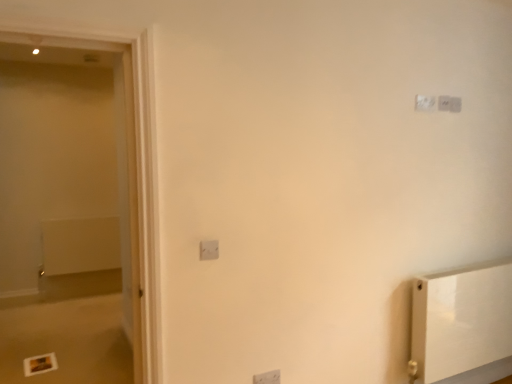
At what (x,y) coordinates should I click in order to perform the action: click on white plastic light switch at center, arranged as the 2th light switch when viewed from the left. Please return your answer as a coordinate pair (x, y). This screenshot has height=384, width=512. Looking at the image, I should click on 267,378.

Locate an element on the screen. The width and height of the screenshot is (512, 384). white matte radiator at left is located at coordinates (80, 245).

What are the coordinates of `white plastic light switch at upper right, the second light switch positioned from the right` in the screenshot? It's located at (425, 103).

How much space does white plastic light switch at upper right, arranged as the 4th light switch when ordered from the bottom, occupy vertically?

3.67 inches.

You are a GUI agent. You are given a task and a screenshot of the screen. Output one action in this format:
    pyautogui.click(x=<x>, y=<y>)
    Task: Click on the white plastic light switch at center, positioned as the second light switch in front-to-back order
    
    Given the screenshot: What is the action you would take?
    pyautogui.click(x=267, y=378)

Which is in front, white matte radiator at left or white plastic light switch at center, the 4th light switch in the top-to-bottom sequence?

Positioned in front is white plastic light switch at center, the 4th light switch in the top-to-bottom sequence.

Is white matte radiator at left inside the boundaries of white plastic light switch at center, the 4th light switch in the top-to-bottom sequence, or outside?

The correct answer is: outside.

Which of these two, white matte radiator at left or white plastic light switch at center, the 4th light switch in the top-to-bottom sequence, is thinner?

With smaller width is white plastic light switch at center, the 4th light switch in the top-to-bottom sequence.

This screenshot has height=384, width=512. What are the coordinates of `radiator on the left of white plastic light switch at center, acting as the 3th light switch starting from the back` in the screenshot? It's located at (80, 245).

Is white glossy screen door at left thinner than white plastic light switch at upper right, arranged as the 4th light switch when ordered from the bottom?

No, white glossy screen door at left is not thinner than white plastic light switch at upper right, arranged as the 4th light switch when ordered from the bottom.

Can we say white glossy screen door at left lies outside white plastic light switch at upper right, the fourth light switch in the left-to-right sequence?

Absolutely, white glossy screen door at left is external to white plastic light switch at upper right, the fourth light switch in the left-to-right sequence.

How distant is white glossy screen door at left from white plastic light switch at upper right, the fourth light switch in the left-to-right sequence?

They are 1.87 meters apart.

Between white glossy screen door at left and white plastic light switch at upper right, the 1th light switch viewed from the right, which one appears on the right side from the viewer's perspective?

Positioned to the right is white plastic light switch at upper right, the 1th light switch viewed from the right.

Can you tell me how much white plastic light switch at center, which is the third light switch in right-to-left order, and white plastic light switch at upper right, arranged as the 4th light switch when ordered from the bottom, differ in facing direction?

0.0305 degrees.

Which light switch is the 2nd one when counting from the front of the white plastic light switch at upper right, the 1th light switch viewed from the right? Please provide its 2D coordinates.

[(267, 378)]

From the picture: Which is less distant, (x=271, y=381) or (x=451, y=103)?

The point (x=271, y=381) is in front.

Based on the photo, choose the correct answer: Is white matte radiator at left inside white plastic light switch at upper right, positioned as the third light switch in bottom-to-top order, or outside it?

white matte radiator at left lies outside white plastic light switch at upper right, positioned as the third light switch in bottom-to-top order.

Considering the relative sizes of white matte radiator at left and white plastic light switch at upper right, which appears as the 2th light switch when viewed from the back, in the image provided, is white matte radiator at left smaller than white plastic light switch at upper right, which appears as the 2th light switch when viewed from the back,?

No, white matte radiator at left is not smaller than white plastic light switch at upper right, which appears as the 2th light switch when viewed from the back.

Considering the relative positions of white matte radiator at left and white plastic light switch at upper right, which appears as the 2th light switch when viewed from the back, in the image provided, is white matte radiator at left to the left of white plastic light switch at upper right, which appears as the 2th light switch when viewed from the back, from the viewer's perspective?

Indeed, white matte radiator at left is positioned on the left side of white plastic light switch at upper right, which appears as the 2th light switch when viewed from the back.

Considering their positions, is white matte radiator at left located in front of or behind white plastic light switch at upper right, which appears as the 2th light switch when viewed from the back?

Clearly, white matte radiator at left is behind white plastic light switch at upper right, which appears as the 2th light switch when viewed from the back.

Is white plastic light switch at upper right, the third light switch viewed from the front, inside white plastic light switch at center, the 4th light switch positioned from the right?

No, white plastic light switch at upper right, the third light switch viewed from the front, is located outside of white plastic light switch at center, the 4th light switch positioned from the right.

From the image's perspective, which is above, white plastic light switch at center, the 2th light switch in the bottom-to-top sequence, or white plastic light switch at upper right, the second light switch positioned from the top?

white plastic light switch at upper right, the second light switch positioned from the top, appears higher in the image.

Are white plastic light switch at center, the 4th light switch positioned from the right, and white plastic light switch at upper right, positioned as the third light switch in bottom-to-top order, beside each other?

white plastic light switch at center, the 4th light switch positioned from the right, and white plastic light switch at upper right, positioned as the third light switch in bottom-to-top order, are clearly separated.

Is white plastic light switch at center, which appears as the third light switch when viewed from the top, at the right side of white plastic light switch at upper right, which appears as the 2th light switch when viewed from the back?

Incorrect, white plastic light switch at center, which appears as the third light switch when viewed from the top, is not on the right side of white plastic light switch at upper right, which appears as the 2th light switch when viewed from the back.

Is point (456, 106) positioned in front of point (216, 256)?

No, (456, 106) is behind (216, 256).

Are white plastic light switch at upper right, marked as the 4th light switch in a front-to-back arrangement, and white plastic light switch at center, the 4th light switch viewed from the back, far apart?

Yes, white plastic light switch at upper right, marked as the 4th light switch in a front-to-back arrangement, and white plastic light switch at center, the 4th light switch viewed from the back, are quite far apart.

From a real-world perspective, who is located lower, white plastic light switch at upper right, the fourth light switch in the left-to-right sequence, or white plastic light switch at center, which is counted as the first light switch, starting from the front?

white plastic light switch at center, which is counted as the first light switch, starting from the front.

Locate an element on the screen. The image size is (512, 384). the 2nd light switch directly beneath the white plastic light switch at upper right, the fourth light switch in the left-to-right sequence (from a real-world perspective) is located at coordinates (209, 250).

In the scene shown: Is white matte radiator at left facing away from white glossy screen door at left?

white matte radiator at left is not turned away from white glossy screen door at left.

From the image's perspective, which object appears higher, white matte radiator at left or white glossy screen door at left?

white glossy screen door at left appears higher in the image.

From a real-world perspective, is white matte radiator at left positioned above or below white glossy screen door at left?

Clearly, from a real-world perspective, white matte radiator at left is below white glossy screen door at left.

Is white matte radiator at left wider or thinner than white glossy screen door at left?

white matte radiator at left is thinner than white glossy screen door at left.

Locate an element on the screen. This screenshot has width=512, height=384. light switch that is under the white matte radiator at left (from a real-world perspective) is located at coordinates (x=267, y=378).

There is a white glossy screen door at left. Identify the location of the 2nd light switch above it (from a real-world perspective). (449, 104).

Which object lies further to the anchor point white plastic light switch at upper right, which is the 1th light switch in back-to-front order, white matte radiator at left or white glossy screen door at left?

white matte radiator at left is positioned further to the anchor white plastic light switch at upper right, which is the 1th light switch in back-to-front order.

Estimate the real-world distances between objects in this image. Which object is closer to white plastic light switch at center, which is counted as the first light switch, starting from the front, white plastic light switch at upper right, the second light switch positioned from the top, or white matte radiator at left?

The object closer to white plastic light switch at center, which is counted as the first light switch, starting from the front, is white plastic light switch at upper right, the second light switch positioned from the top.

Based on their spatial positions, is white plastic light switch at center, which appears as the third light switch when viewed from the top, or white glossy screen door at left further from white plastic light switch at center, which is the third light switch in right-to-left order?

The object further to white plastic light switch at center, which is the third light switch in right-to-left order, is white glossy screen door at left.

Estimate the real-world distances between objects in this image. Which object is further from white plastic light switch at center, arranged as the 2th light switch when viewed from the left, white plastic light switch at center, the 4th light switch viewed from the back, or white plastic light switch at upper right, the second light switch positioned from the right?

white plastic light switch at upper right, the second light switch positioned from the right.

Based on their spatial positions, is white glossy screen door at left or white plastic light switch at upper right, which appears as the 2th light switch when viewed from the back, closer to white matte radiator at left?

white glossy screen door at left lies closer to white matte radiator at left than the other object.

Considering their positions, is white plastic light switch at center, which is counted as the first light switch, starting from the front, positioned closer to white plastic light switch at upper right, arranged as the 4th light switch when ordered from the bottom, than white plastic light switch at center, placed as the first light switch when sorted from bottom to top?

white plastic light switch at center, which is counted as the first light switch, starting from the front, lies closer to white plastic light switch at upper right, arranged as the 4th light switch when ordered from the bottom, than the other object.

Considering their positions, is white glossy screen door at left positioned closer to white plastic light switch at center, which appears as the third light switch when viewed from the top, than white plastic light switch at upper right, the fourth light switch in the left-to-right sequence?

white glossy screen door at left is positioned closer to the anchor white plastic light switch at center, which appears as the third light switch when viewed from the top.

Considering their positions, is white plastic light switch at center, the 4th light switch viewed from the back, positioned closer to white plastic light switch at upper right, marked as the 4th light switch in a front-to-back arrangement, than white plastic light switch at upper right, which is the third light switch from left to right?

Among the two, white plastic light switch at upper right, which is the third light switch from left to right, is located nearer to white plastic light switch at upper right, marked as the 4th light switch in a front-to-back arrangement.

At what (x,y) coordinates should I click in order to perform the action: click on screen door between white matte radiator at left and white plastic light switch at upper right, the 1th light switch viewed from the right, from left to right. Please return your answer as a coordinate pair (x, y). Looking at the image, I should click on (124, 165).

Identify the location of light switch between white plastic light switch at upper right, the third light switch viewed from the front, and white plastic light switch at center, the 4th light switch in the top-to-bottom sequence, vertically. (209, 250).

This screenshot has width=512, height=384. I want to click on light switch between white glossy screen door at left and white plastic light switch at center, which is the third light switch in right-to-left order, in the vertical direction, so click(209, 250).